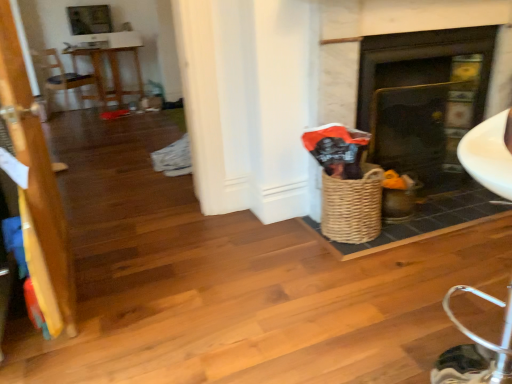
Locate an element on the screen. vacant area that is situated to the right of woven brown basket at right is located at coordinates (405, 225).